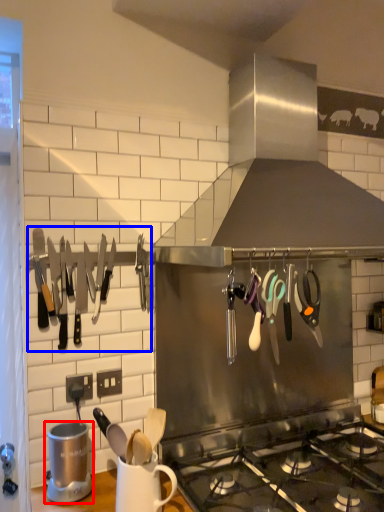
Question: Among these objects, which one is farthest to the camera, appliance (highlighted by a red box) or cutlery (highlighted by a blue box)?

Choices:
 (A) appliance
 (B) cutlery

Answer: (B)